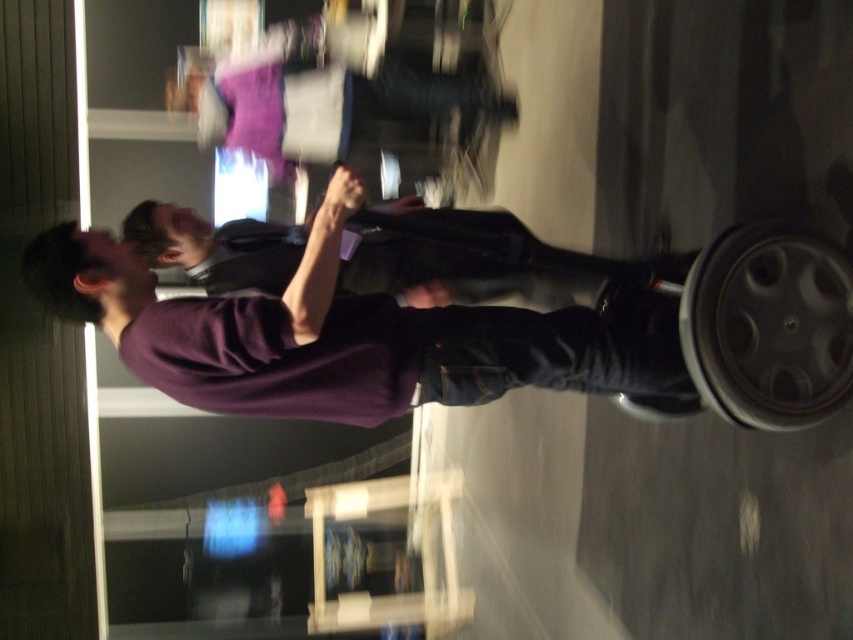
You are standing in the room and see the point at coordinates [482,257]. Which object is this point located on?

The point at coordinates [482,257] is located on the purple matte sweater at center.

You are organizing a clothing display and need to arrange the purple matte shirt at center and the purple matte sweater at center vertically. Which item should be placed higher up on the rack to ensure proper visibility of both items?

The purple matte shirt at center should be placed higher up on the rack since it has a greater height compared to the purple matte sweater at center, ensuring both items are visible.